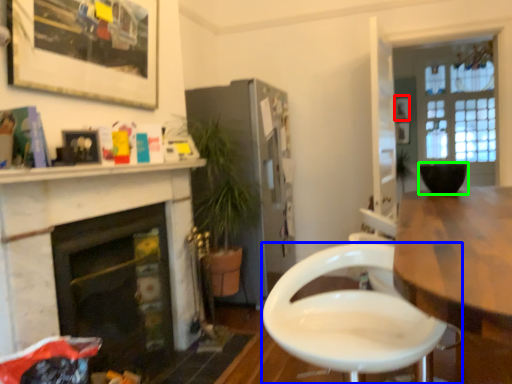
Question: Which object is positioned closest to picture frame (highlighted by a red box)? Select from chair (highlighted by a blue box) and flowerpot (highlighted by a green box).

Choices:
 (A) chair
 (B) flowerpot

Answer: (B)